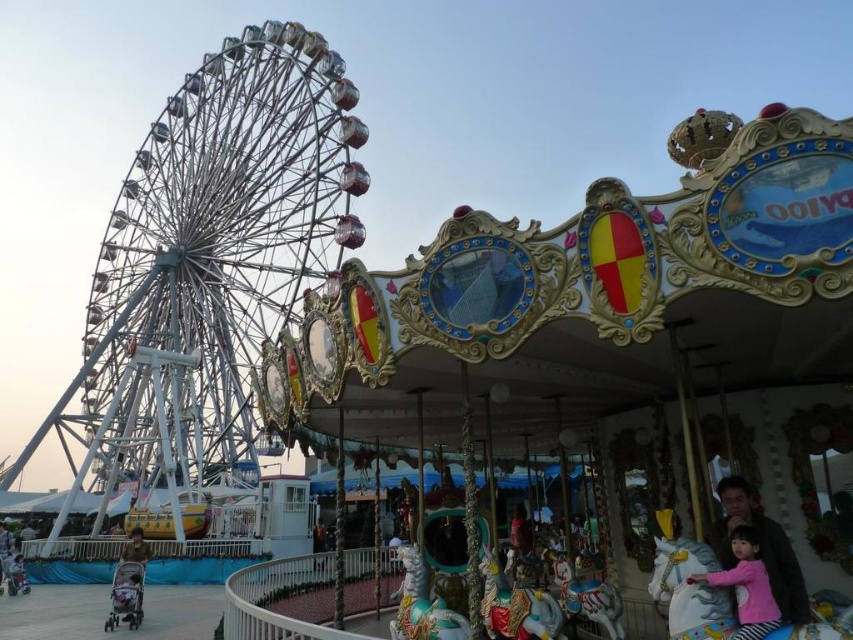
Question: Which object appears closest to the camera in this image?

Choices:
 (A) white metallic ferris wheel at left
 (B) matte pink dress at center
 (C) pink fabric at center

Answer: (B)

Question: Can you confirm if pink fabric at center is smaller than matte pink dress at center?

Choices:
 (A) yes
 (B) no

Answer: (B)

Question: Considering the real-world distances, which object is farthest from the white metallic ferris wheel at left?

Choices:
 (A) pink fabric at center
 (B) matte pink dress at center

Answer: (A)

Question: Which point is farther to the camera?

Choices:
 (A) matte pink dress at center
 (B) white metallic ferris wheel at left

Answer: (B)

Question: In this image, where is pink fabric at center located relative to matte pink dress at center?

Choices:
 (A) above
 (B) below

Answer: (A)

Question: Does pink fabric at center appear over matte pink dress at center?

Choices:
 (A) no
 (B) yes

Answer: (B)